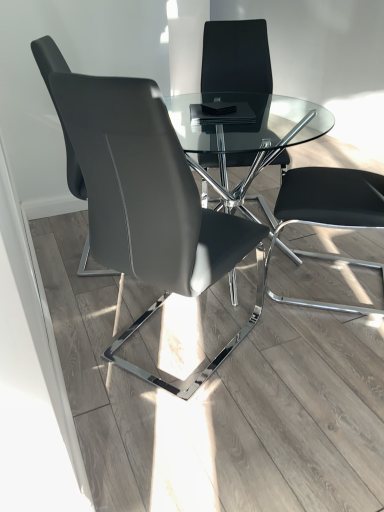
Question: From a real-world perspective, is black leather chair at right positioned above or below matte black chair at center, positioned as the third chair in back-to-front order?

Choices:
 (A) below
 (B) above

Answer: (B)

Question: From the image's perspective, is black leather chair at right positioned above or below matte black chair at center, positioned as the third chair in back-to-front order?

Choices:
 (A) below
 (B) above

Answer: (B)

Question: Which object is the closest to the black leather chair at center, which is counted as the first chair, starting from the back?

Choices:
 (A) matte black chair at center, positioned as the third chair in back-to-front order
 (B) black leather chair at right
 (C) matte black chair at left, which is the second chair in back-to-front order

Answer: (B)

Question: Which of these objects is positioned closest to the black leather chair at center, which is counted as the first chair, starting from the back?

Choices:
 (A) matte black chair at left, the 2th chair viewed from the front
 (B) black leather chair at right
 (C) matte black chair at center, placed as the first chair when sorted from front to back

Answer: (B)